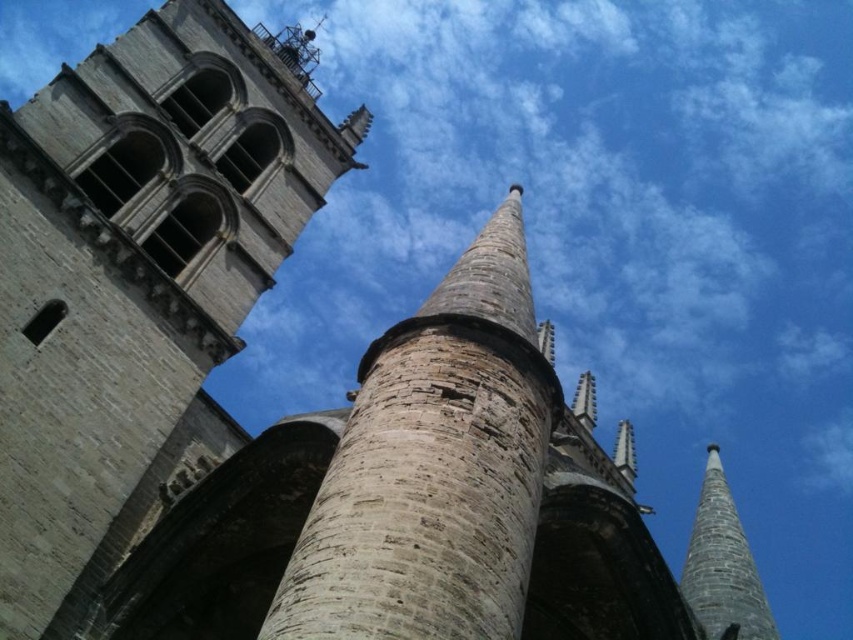
Question: Which object appears closest to the camera in this image?

Choices:
 (A) smooth gray stone spire at right
 (B) stone textured pillar at center
 (C) stone tower at center

Answer: (B)

Question: Can you confirm if stone textured pillar at center is positioned to the right of smooth gray stone spire at right?

Choices:
 (A) yes
 (B) no

Answer: (B)

Question: Is stone tower at center above stone textured pillar at center?

Choices:
 (A) no
 (B) yes

Answer: (B)

Question: Which point appears farthest from the camera in this image?

Choices:
 (A) (221, 326)
 (B) (747, 588)

Answer: (A)

Question: Which object is farther from the camera taking this photo?

Choices:
 (A) smooth gray stone spire at right
 (B) stone tower at center

Answer: (A)

Question: Is stone tower at center below stone textured pillar at center?

Choices:
 (A) no
 (B) yes

Answer: (A)